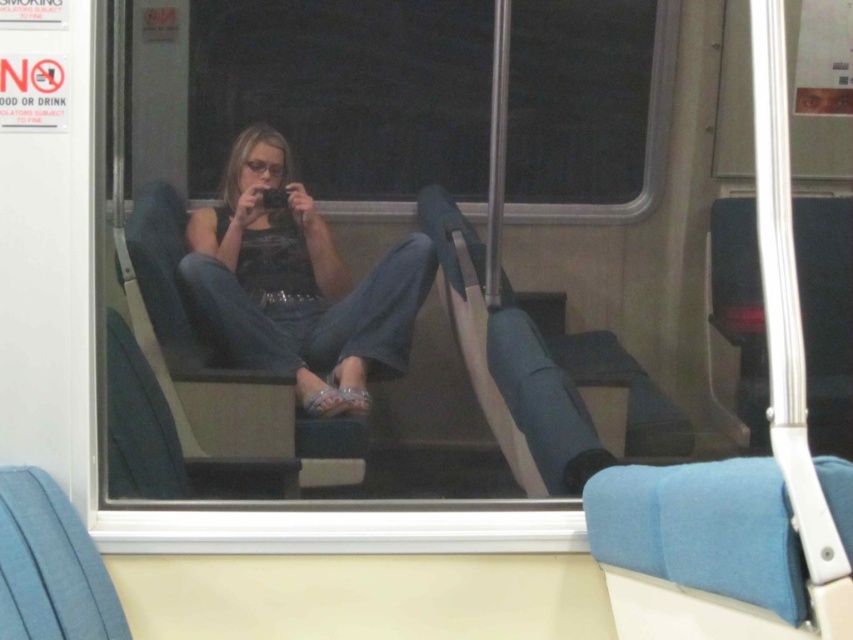
Question: Does denim jeans at center appear under transparent glass window at center?

Choices:
 (A) no
 (B) yes

Answer: (B)

Question: Which of the following is the farthest from the observer?

Choices:
 (A) denim jeans at center
 (B) transparent glass window at center

Answer: (B)

Question: Does denim jeans at center lie behind transparent glass window at center?

Choices:
 (A) no
 (B) yes

Answer: (A)

Question: Which point is closer to the camera?

Choices:
 (A) (660, 86)
 (B) (345, 326)

Answer: (B)

Question: Can you confirm if denim jeans at center is positioned above transparent glass window at center?

Choices:
 (A) no
 (B) yes

Answer: (A)